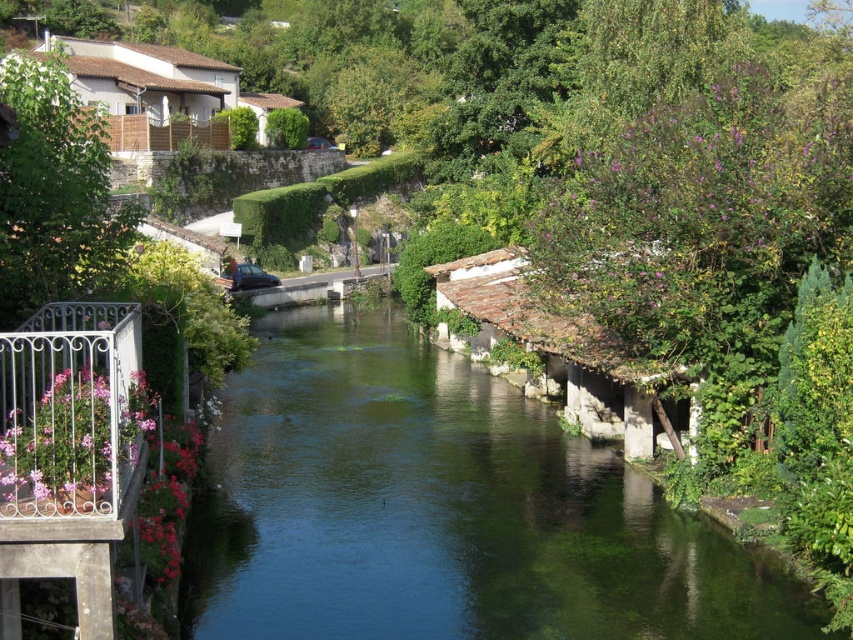
You are standing at the center of the image and want to locate the green stone river at center. Which direction should you look to find it?

The green stone river at center is located at point coordinates of (444, 509). Since you are at the center of the image, you should look towards the right direction to find it.

You are planning to cross the river using a small boat that can only carry items up to 1 meter in width. Based on the scene, can the boat safely carry the metallic wrought iron balcony at lower left across the green stone river at center?

The green stone river at center is wider than the metallic wrought iron balcony at lower left. Since the boat can carry items up to 1 meter wide, and the balcony is narrower than the river, it can safely be transported across.

You are standing on the riverside path and want to take a photo of the metallic wrought iron balcony at lower left and the green stone river at center. Which object will appear closer to the camera in the photo?

The green stone river at center will appear closer to the camera in the photo because the metallic wrought iron balcony at lower left is behind it.